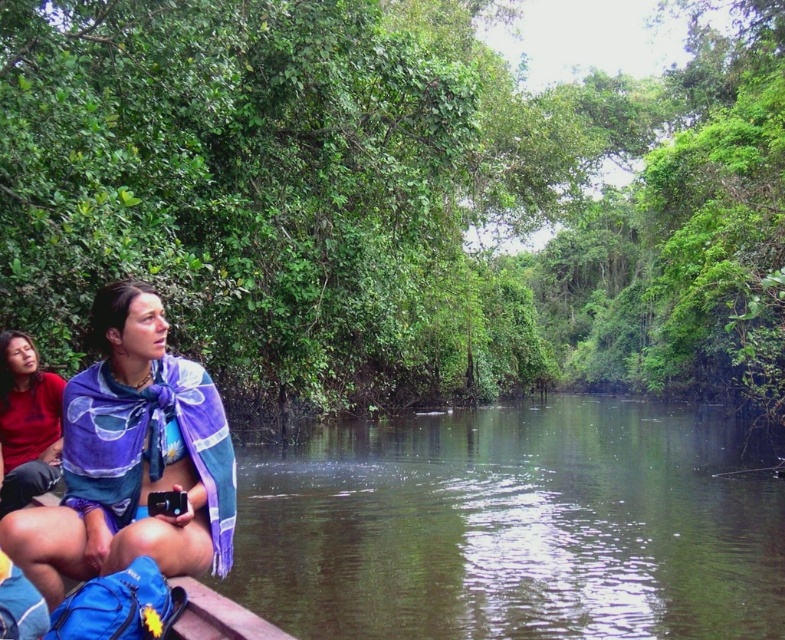
Who is positioned more to the right, green leafy jungle at upper center or matte red shirt at left?

From the viewer's perspective, green leafy jungle at upper center appears more on the right side.

Who is taller, green leafy jungle at upper center or matte red shirt at left?

With more height is green leafy jungle at upper center.

Locate an element on the screen. green leafy jungle at upper center is located at coordinates (393, 198).

Is point (173, 433) positioned in front of point (49, 387)?

Yes, point (173, 433) is in front of point (49, 387).

Does point (75, 433) come behind point (4, 428)?

No, (75, 433) is closer to viewer.

Who is more distant from viewer, [210,396] or [16,451]?

Positioned behind is point [16,451].

Identify the location of purple woven scarf at lower left. The height and width of the screenshot is (640, 785). (132, 458).

Is point (738, 522) farther from viewer compared to point (17, 420)?

Yes.

The height and width of the screenshot is (640, 785). What are the coordinates of `green murky water at center` in the screenshot? It's located at (515, 525).